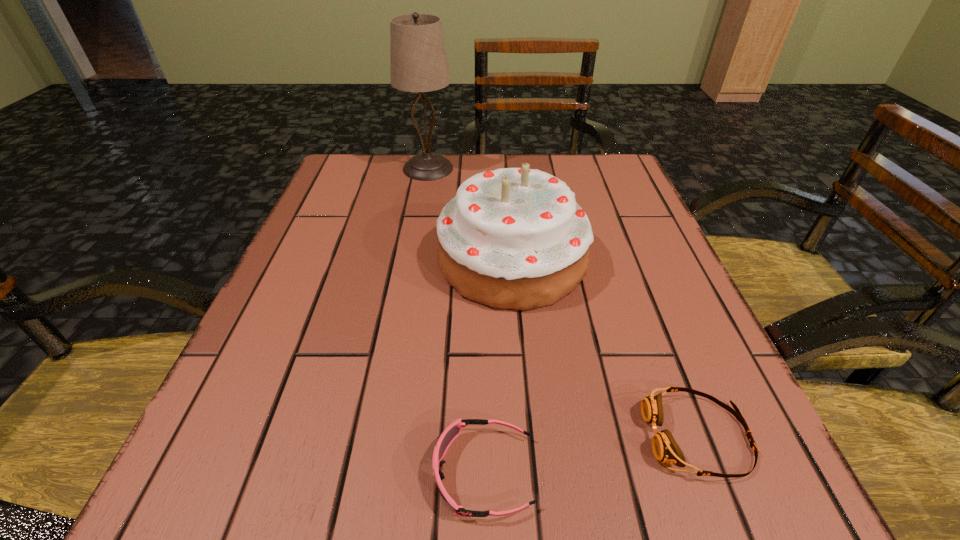
At what (x,y) coordinates should I click in order to perform the action: click on free region located with the lenses facing forward on the right goggles. Please return your answer as a coordinate pair (x, y). This screenshot has height=540, width=960. Looking at the image, I should click on (587, 436).

At what (x,y) coordinates should I click in order to perform the action: click on free spot located on the front-facing side of the left goggles. Please return your answer as a coordinate pair (x, y). The width and height of the screenshot is (960, 540). Looking at the image, I should click on (x=363, y=473).

The width and height of the screenshot is (960, 540). I want to click on free spot located on the front-facing side of the left goggles, so tap(331, 473).

This screenshot has height=540, width=960. What are the coordinates of `free space located 0.150m on the front-facing side of the left goggles` in the screenshot? It's located at (315, 473).

The height and width of the screenshot is (540, 960). Identify the location of object located at the far edge. (418, 62).

Locate an element on the screen. The height and width of the screenshot is (540, 960). object that is at the right edge is located at coordinates (665, 448).

The image size is (960, 540). What are the coordinates of `object at the near right corner` in the screenshot? It's located at (665, 448).

In the image, there is a desktop. Identify the location of vacant space at the far edge. (450, 198).

The image size is (960, 540). In the image, there is a desktop. Find the location of `vacant space at the near edge`. vacant space at the near edge is located at coordinates (655, 524).

At what (x,y) coordinates should I click in order to perform the action: click on free space at the left edge of the desktop. Please return your answer as a coordinate pair (x, y). This screenshot has width=960, height=540. Looking at the image, I should click on (207, 434).